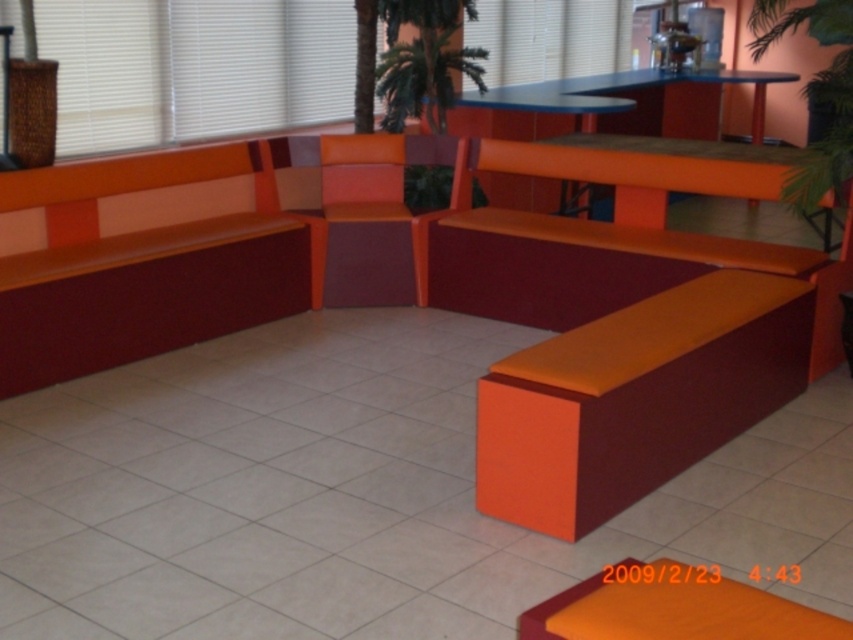
Question: Can you confirm if orange matte bench at lower right is positioned to the left of green leafy palm tree at upper center?

Choices:
 (A) no
 (B) yes

Answer: (A)

Question: Which of the following is the farthest from the observer?

Choices:
 (A) matte orange chair at center
 (B) orange matte table at upper center
 (C) orange matte bench at center

Answer: (B)

Question: Observing the image, what is the correct spatial positioning of orange matte bench at left in reference to maroon fabric bench at center?

Choices:
 (A) below
 (B) above

Answer: (B)

Question: Which object is the farthest from the matte orange chair at center?

Choices:
 (A) maroon fabric bench at center
 (B) orange matte bench at center

Answer: (B)

Question: Which point is closer to the camera taking this photo?

Choices:
 (A) (376, 200)
 (B) (602, 452)
 (C) (393, 109)

Answer: (B)

Question: Can you confirm if orange matte bench at lower right is positioned to the right of orange matte table at upper center?

Choices:
 (A) yes
 (B) no

Answer: (B)